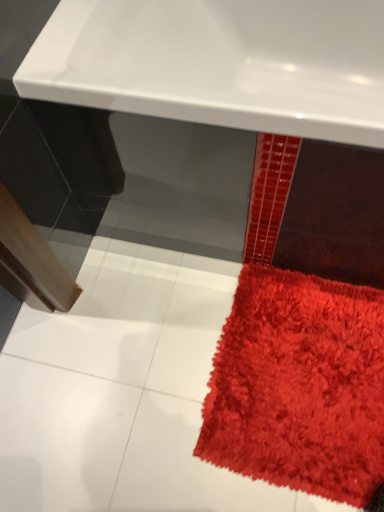
Question: From the image's perspective, is shaggy red rug at lower right positioned above or below white glossy sink at upper center?

Choices:
 (A) below
 (B) above

Answer: (A)

Question: Does point (236, 388) appear closer or farther from the camera than point (140, 13)?

Choices:
 (A) farther
 (B) closer

Answer: (A)

Question: From their relative heights in the image, would you say shaggy red rug at lower right is taller or shorter than white glossy sink at upper center?

Choices:
 (A) tall
 (B) short

Answer: (B)

Question: Considering the positions of white glossy sink at upper center and shaggy red rug at lower right in the image, is white glossy sink at upper center taller or shorter than shaggy red rug at lower right?

Choices:
 (A) tall
 (B) short

Answer: (A)

Question: Considering the positions of white glossy sink at upper center and shaggy red rug at lower right in the image, is white glossy sink at upper center wider or thinner than shaggy red rug at lower right?

Choices:
 (A) wide
 (B) thin

Answer: (A)

Question: From the image's perspective, relative to shaggy red rug at lower right, is white glossy sink at upper center above or below?

Choices:
 (A) above
 (B) below

Answer: (A)

Question: Is white glossy sink at upper center in front of or behind shaggy red rug at lower right in the image?

Choices:
 (A) front
 (B) behind

Answer: (A)